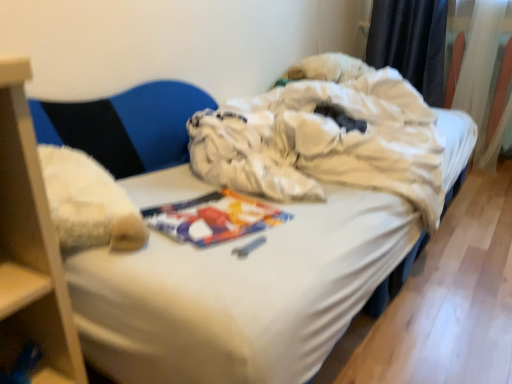
Question: From a real-world perspective, is white fabric bed at center above or below white sheer curtain at upper right, which is the 1th curtain from right to left?

Choices:
 (A) above
 (B) below

Answer: (B)

Question: From the image's perspective, is white fabric bed at center above or below white sheer curtain at upper right, which is the 1th curtain from right to left?

Choices:
 (A) above
 (B) below

Answer: (B)

Question: Based on their relative distances, which object is farther from the white sheer curtain at upper right, which is the 1th curtain from right to left?

Choices:
 (A) black fabric curtain at upper right, marked as the first curtain in a left-to-right arrangement
 (B) white fabric bed at center
 (C) fuzzy fabric armchair at left

Answer: (C)

Question: Which is farther from the black fabric curtain at upper right, which is counted as the second curtain, starting from the right?

Choices:
 (A) fuzzy fabric armchair at left
 (B) white fabric bed at center
 (C) white sheer curtain at upper right, which is the 1th curtain from right to left

Answer: (A)